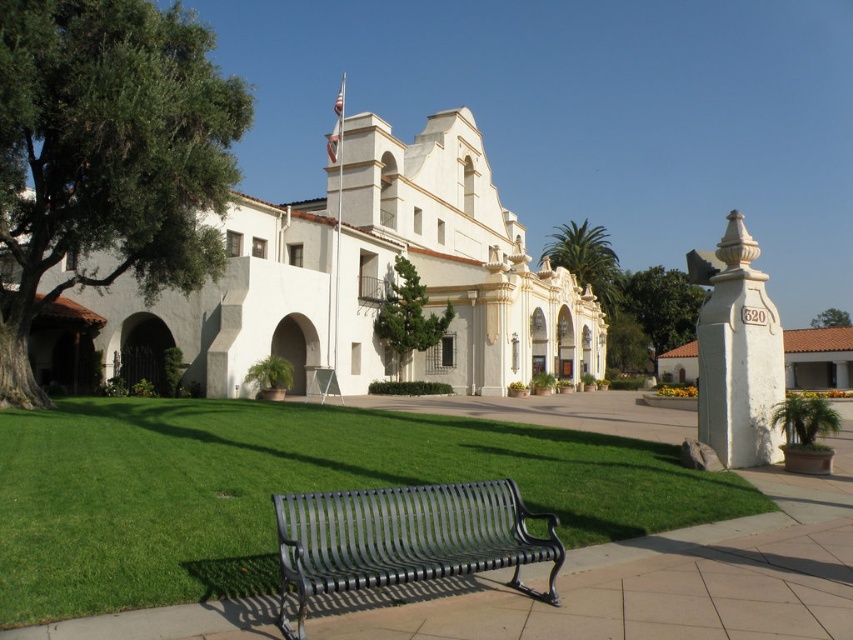
Which is more to the left, green grass at center or green leafy tree at upper right?

From the viewer's perspective, green grass at center appears more on the left side.

Does green grass at center appear on the right side of green leafy tree at upper right?

Incorrect, green grass at center is not on the right side of green leafy tree at upper right.

Is point (403, 428) in front of point (824, 317)?

That is True.

This screenshot has width=853, height=640. I want to click on green grass at center, so click(282, 490).

Does point (212, 525) come behind point (701, 358)?

No.

Between point (579, 502) and point (704, 273), which one is positioned behind?

The point (704, 273) is more distant.

The height and width of the screenshot is (640, 853). I want to click on green grass at center, so click(282, 490).

Between green leafy tree at left and white stone column at right, which one appears on the left side from the viewer's perspective?

Positioned to the left is green leafy tree at left.

Is green leafy tree at left to the right of white stone column at right from the viewer's perspective?

Incorrect, green leafy tree at left is not on the right side of white stone column at right.

Who is more distant from viewer, (x=224, y=134) or (x=732, y=248)?

Positioned behind is point (x=224, y=134).

Locate an element on the screen. green leafy tree at left is located at coordinates (107, 156).